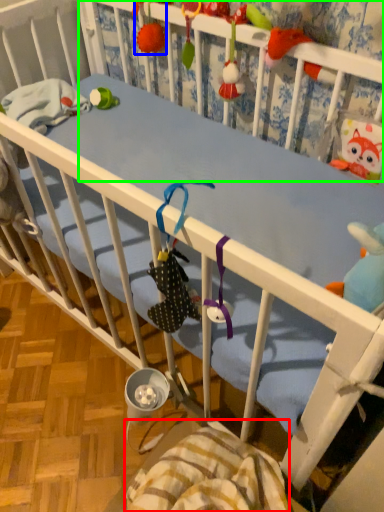
Question: Which object is positioned closest to blanket (highlighted by a red box)? Select from toy (highlighted by a blue box) and infant bed (highlighted by a green box).

Choices:
 (A) toy
 (B) infant bed

Answer: (B)